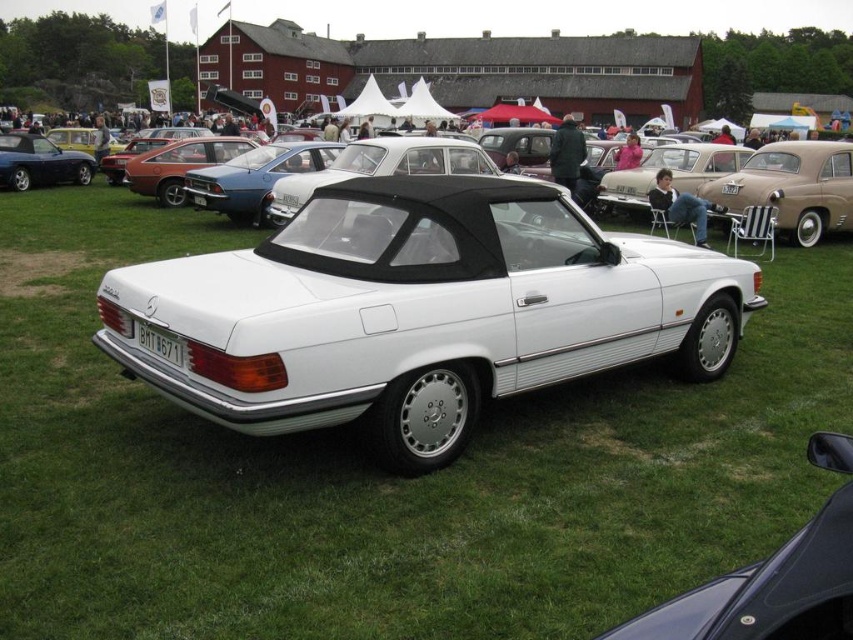
You are a photographer at the classic car event and need to position yourself to capture the white matte convertible at center against the backdrop of the large red barn. Based on the car and barn locations, where should you stand relative to the car to ensure the barn is fully visible behind it?

The white matte convertible at center is positioned centrally in the scene, so standing directly in front of it while facing the large red barn in the background will ensure the barn is fully visible behind the car.

You are standing at the center of the grassy field where the white Mercedes is parked. There is a point marked at coordinates (421, 310). What object is located exactly at that point?

The white matte convertible at center is located exactly at point (421, 310).

You are standing at the event and want to take a photo of the white matte convertible at center. If your camera has a minimum focus distance of 3 meters, will you be able to take a clear photo without moving closer?

The white matte convertible at center is 3.59 meters away from the viewer. Since the camera requires a minimum focus distance of 3 meters, the distance is sufficient to take a clear photo without moving closer.